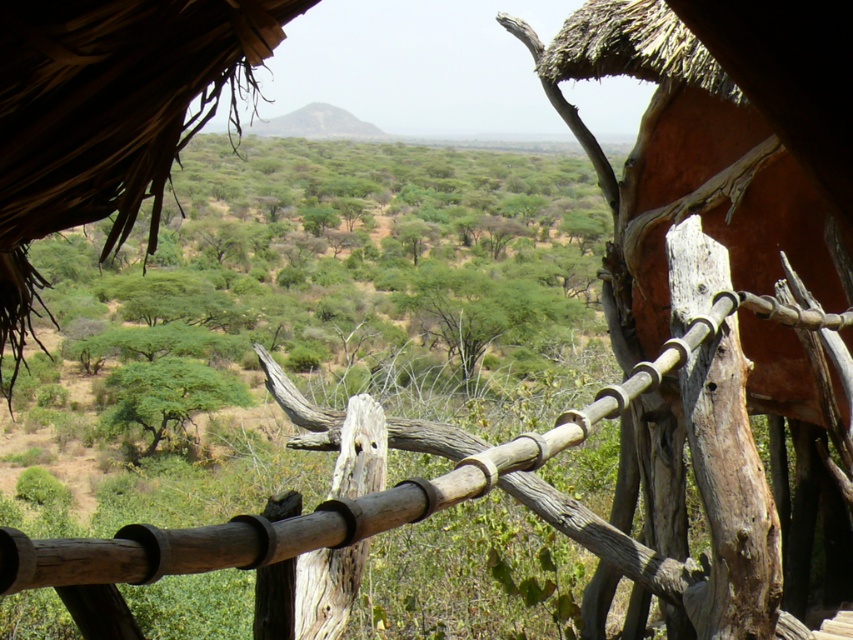
Question: Among these points, which one is nearest to the camera?

Choices:
 (A) (503, 445)
 (B) (115, 404)

Answer: (A)

Question: Does brown wooden fence at center have a smaller size compared to green leafy tree at center?

Choices:
 (A) no
 (B) yes

Answer: (A)

Question: Is brown wooden fence at center wider than green leafy tree at center?

Choices:
 (A) no
 (B) yes

Answer: (B)

Question: Is brown wooden fence at center bigger than green leafy tree at center?

Choices:
 (A) no
 (B) yes

Answer: (B)

Question: Among these points, which one is nearest to the camera?

Choices:
 (A) click(271, 529)
 (B) click(190, 396)

Answer: (A)